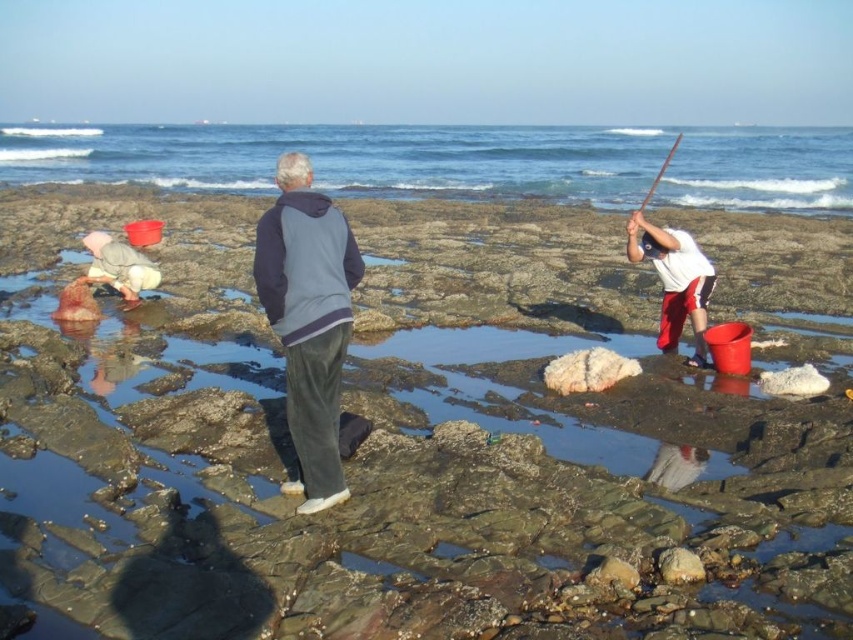
Who is positioned more to the right, blue ocean water at upper center or white cotton shirt at right?

Positioned to the right is blue ocean water at upper center.

Can you confirm if blue ocean water at upper center is positioned above white cotton shirt at right?

Indeed, blue ocean water at upper center is positioned over white cotton shirt at right.

This screenshot has height=640, width=853. What do you see at coordinates (349, 157) in the screenshot? I see `blue ocean water at upper center` at bounding box center [349, 157].

Find the location of `blue ocean water at upper center`. blue ocean water at upper center is located at coordinates (349, 157).

Who is lower down, blue ocean water at upper center or gray fleece jacket at center?

gray fleece jacket at center is below.

The image size is (853, 640). I want to click on blue ocean water at upper center, so click(349, 157).

Where is `blue ocean water at upper center`? The height and width of the screenshot is (640, 853). blue ocean water at upper center is located at coordinates (349, 157).

Can you confirm if gray fleece jacket at center is positioned below white cotton shirt at right?

Yes, gray fleece jacket at center is below white cotton shirt at right.

Is gray fleece jacket at center to the left of white cotton shirt at right from the viewer's perspective?

Correct, you'll find gray fleece jacket at center to the left of white cotton shirt at right.

Between point (318, 461) and point (674, 292), which one is positioned in front?

Point (318, 461) is in front.

Locate an element on the screen. The height and width of the screenshot is (640, 853). gray fleece jacket at center is located at coordinates (308, 321).